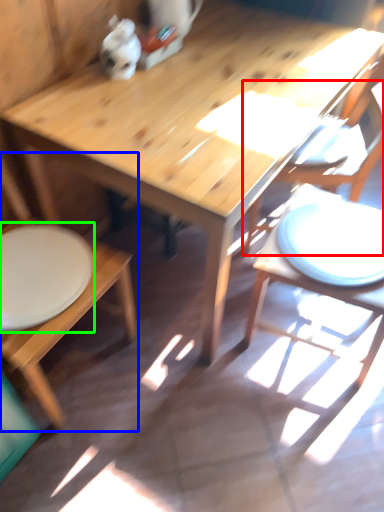
Question: Which object is positioned closest to chair (highlighted by a red box)? Select from chair (highlighted by a blue box) and plate (highlighted by a green box).

Choices:
 (A) chair
 (B) plate

Answer: (B)